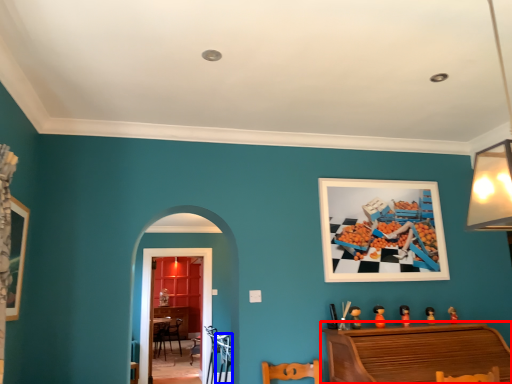
Question: Which point is closer to the camera, furniture (highlighted by a red box) or armchair (highlighted by a blue box)?

Choices:
 (A) furniture
 (B) armchair

Answer: (A)